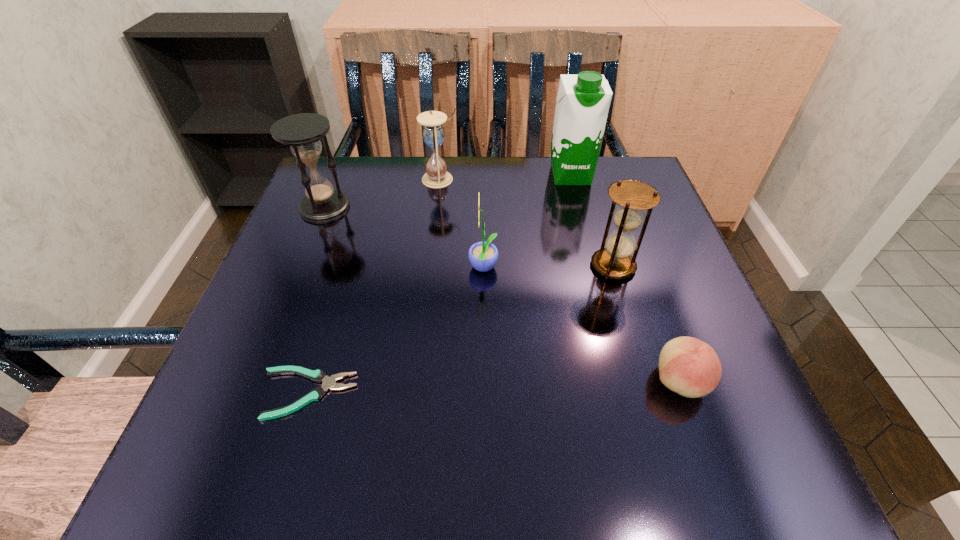
Find the location of a particular element. The image size is (960, 540). the tallest object is located at coordinates (582, 104).

Where is `the leftmost hourglass`? Image resolution: width=960 pixels, height=540 pixels. the leftmost hourglass is located at coordinates (302, 132).

Find the location of a particular element. The image size is (960, 540). the third farthest object is located at coordinates (302, 132).

Locate an element on the screen. the farthest hourglass is located at coordinates (433, 134).

Identify the location of the third object from left to right. (433, 134).

Where is `the rightmost hourglass`? This screenshot has height=540, width=960. the rightmost hourglass is located at coordinates (614, 261).

Identify the location of sunflower. The image size is (960, 540). (483, 256).

The height and width of the screenshot is (540, 960). In order to click on the second shortest object in this screenshot , I will do `click(688, 366)`.

You are a GUI agent. You are given a task and a screenshot of the screen. Output one action in this format:
    pyautogui.click(x=<x>, y=<y>)
    Task: Click on the shortest object
    The width and height of the screenshot is (960, 540).
    Given the screenshot: What is the action you would take?
    pyautogui.click(x=319, y=376)

Identify the location of vacant space located on the front-facing side of the tallest object. The width and height of the screenshot is (960, 540). (602, 298).